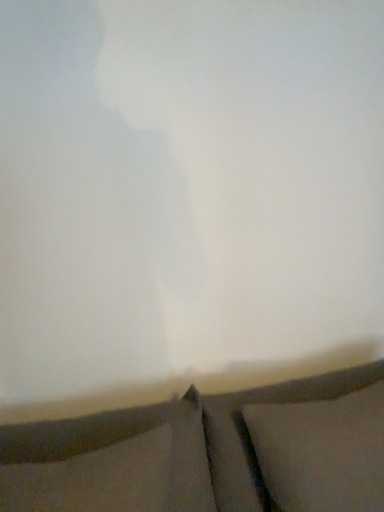
This screenshot has height=512, width=384. Describe the element at coordinates (322, 452) in the screenshot. I see `white soft pillow at lower right, the first pillow in the right-to-left sequence` at that location.

This screenshot has height=512, width=384. In order to click on dark gray fabric pillow at lower center, the first pillow in the left-to-right sequence in this screenshot , I will do `click(109, 462)`.

What's the angular difference between dark gray fabric pillow at lower center, the first pillow in the left-to-right sequence, and white soft pillow at lower right, which is the 2th pillow from left to right,'s facing directions?

There is a 0.000762-degree angle between the facing directions of dark gray fabric pillow at lower center, the first pillow in the left-to-right sequence, and white soft pillow at lower right, which is the 2th pillow from left to right.

Is there a large distance between dark gray fabric pillow at lower center, positioned as the 2th pillow in right-to-left order, and white soft pillow at lower right, the first pillow in the right-to-left sequence?

dark gray fabric pillow at lower center, positioned as the 2th pillow in right-to-left order, is near white soft pillow at lower right, the first pillow in the right-to-left sequence, not far away.

From the image's perspective, is dark gray fabric pillow at lower center, positioned as the 2th pillow in right-to-left order, located above or below white soft pillow at lower right, the first pillow in the right-to-left sequence?

dark gray fabric pillow at lower center, positioned as the 2th pillow in right-to-left order, is situated higher than white soft pillow at lower right, the first pillow in the right-to-left sequence, in the image.

Does dark gray fabric pillow at lower center, positioned as the 2th pillow in right-to-left order, come in front of white soft pillow at lower right, which is the 2th pillow from left to right?

Yes, dark gray fabric pillow at lower center, positioned as the 2th pillow in right-to-left order, is closer to the viewer.

From a real-world perspective, is white soft pillow at lower right, the first pillow in the right-to-left sequence, positioned above or below textured gray curtain at bottom?

Clearly, from a real-world perspective, white soft pillow at lower right, the first pillow in the right-to-left sequence, is above textured gray curtain at bottom.

From the image's perspective, which is below, white soft pillow at lower right, which is the 2th pillow from left to right, or textured gray curtain at bottom?

textured gray curtain at bottom.

Considering the relative positions of white soft pillow at lower right, which is the 2th pillow from left to right, and textured gray curtain at bottom in the image provided, is white soft pillow at lower right, which is the 2th pillow from left to right, in front of textured gray curtain at bottom?

No, it is behind textured gray curtain at bottom.

Which of these two, white soft pillow at lower right, the first pillow in the right-to-left sequence, or textured gray curtain at bottom, is thinner?

With smaller width is white soft pillow at lower right, the first pillow in the right-to-left sequence.

From the image's perspective, is dark gray fabric pillow at lower center, the first pillow in the left-to-right sequence, beneath textured gray curtain at bottom?

Incorrect, from the image's perspective, dark gray fabric pillow at lower center, the first pillow in the left-to-right sequence, is higher than textured gray curtain at bottom.

What's the angular difference between dark gray fabric pillow at lower center, the first pillow in the left-to-right sequence, and textured gray curtain at bottom's facing directions?

They differ by 0.401 degrees in their facing directions.

Does dark gray fabric pillow at lower center, the first pillow in the left-to-right sequence, appear on the left side of textured gray curtain at bottom?

Correct, you'll find dark gray fabric pillow at lower center, the first pillow in the left-to-right sequence, to the left of textured gray curtain at bottom.

How distant is dark gray fabric pillow at lower center, the first pillow in the left-to-right sequence, from textured gray curtain at bottom?

2.96 inches.

Which is in front, textured gray curtain at bottom or white soft pillow at lower right, the first pillow in the right-to-left sequence?

textured gray curtain at bottom is more forward.

Considering the positions of points (73, 478) and (312, 483), is point (73, 478) farther from camera compared to point (312, 483)?

No.

Can you confirm if textured gray curtain at bottom is taller than white soft pillow at lower right, which is the 2th pillow from left to right?

Yes.

In the scene shown: Can you confirm if textured gray curtain at bottom is thinner than white soft pillow at lower right, which is the 2th pillow from left to right?

No.

From the image's perspective, is white soft pillow at lower right, which is the 2th pillow from left to right, under dark gray fabric pillow at lower center, the first pillow in the left-to-right sequence?

Yes, from the image's perspective, white soft pillow at lower right, which is the 2th pillow from left to right, is beneath dark gray fabric pillow at lower center, the first pillow in the left-to-right sequence.

Which is more to the right, white soft pillow at lower right, the first pillow in the right-to-left sequence, or dark gray fabric pillow at lower center, the first pillow in the left-to-right sequence?

white soft pillow at lower right, the first pillow in the right-to-left sequence, is more to the right.

Is point (275, 486) positioned behind point (86, 492)?

Yes.

Considering the sizes of white soft pillow at lower right, the first pillow in the right-to-left sequence, and dark gray fabric pillow at lower center, positioned as the 2th pillow in right-to-left order, in the image, is white soft pillow at lower right, the first pillow in the right-to-left sequence, bigger or smaller than dark gray fabric pillow at lower center, positioned as the 2th pillow in right-to-left order,?

white soft pillow at lower right, the first pillow in the right-to-left sequence, is bigger than dark gray fabric pillow at lower center, positioned as the 2th pillow in right-to-left order.

In the scene shown: How many degrees apart are the facing directions of textured gray curtain at bottom and dark gray fabric pillow at lower center, the first pillow in the left-to-right sequence?

The angle between the facing direction of textured gray curtain at bottom and the facing direction of dark gray fabric pillow at lower center, the first pillow in the left-to-right sequence, is 0.401 degrees.

Is textured gray curtain at bottom in front of or behind dark gray fabric pillow at lower center, positioned as the 2th pillow in right-to-left order, in the image?

Visually, textured gray curtain at bottom is located in front of dark gray fabric pillow at lower center, positioned as the 2th pillow in right-to-left order.

In order to click on pillow that is the 1st object located behind the textured gray curtain at bottom in this screenshot , I will do `click(109, 462)`.

Is dark gray fabric pillow at lower center, the first pillow in the left-to-right sequence, at the back of textured gray curtain at bottom?

No, textured gray curtain at bottom's orientation is not away from dark gray fabric pillow at lower center, the first pillow in the left-to-right sequence.

This screenshot has width=384, height=512. I want to click on pillow that appears below the dark gray fabric pillow at lower center, positioned as the 2th pillow in right-to-left order (from a real-world perspective), so click(322, 452).

Where is `furniture below the white soft pillow at lower right, the first pillow in the right-to-left sequence (from the image's perspective)`? The width and height of the screenshot is (384, 512). furniture below the white soft pillow at lower right, the first pillow in the right-to-left sequence (from the image's perspective) is located at coordinates (210, 452).

From the image, which object appears to be farther from white soft pillow at lower right, the first pillow in the right-to-left sequence, textured gray curtain at bottom or dark gray fabric pillow at lower center, the first pillow in the left-to-right sequence?

dark gray fabric pillow at lower center, the first pillow in the left-to-right sequence, is positioned further to the anchor white soft pillow at lower right, the first pillow in the right-to-left sequence.

From the image, which object appears to be farther from dark gray fabric pillow at lower center, positioned as the 2th pillow in right-to-left order, textured gray curtain at bottom or white soft pillow at lower right, which is the 2th pillow from left to right?

white soft pillow at lower right, which is the 2th pillow from left to right, is positioned further to the anchor dark gray fabric pillow at lower center, positioned as the 2th pillow in right-to-left order.

When comparing their distances from white soft pillow at lower right, which is the 2th pillow from left to right, does dark gray fabric pillow at lower center, the first pillow in the left-to-right sequence, or textured gray curtain at bottom seem closer?

Based on the image, textured gray curtain at bottom appears to be nearer to white soft pillow at lower right, which is the 2th pillow from left to right.

Estimate the real-world distances between objects in this image. Which object is closer to textured gray curtain at bottom, white soft pillow at lower right, the first pillow in the right-to-left sequence, or dark gray fabric pillow at lower center, positioned as the 2th pillow in right-to-left order?

The object closer to textured gray curtain at bottom is dark gray fabric pillow at lower center, positioned as the 2th pillow in right-to-left order.

Looking at the image, which one is located further to dark gray fabric pillow at lower center, the first pillow in the left-to-right sequence, white soft pillow at lower right, which is the 2th pillow from left to right, or textured gray curtain at bottom?

white soft pillow at lower right, which is the 2th pillow from left to right, is further to dark gray fabric pillow at lower center, the first pillow in the left-to-right sequence.

In the scene shown: Considering their positions, is dark gray fabric pillow at lower center, the first pillow in the left-to-right sequence, positioned closer to textured gray curtain at bottom than white soft pillow at lower right, which is the 2th pillow from left to right?

The object closer to textured gray curtain at bottom is dark gray fabric pillow at lower center, the first pillow in the left-to-right sequence.

The width and height of the screenshot is (384, 512). Find the location of `furniture between dark gray fabric pillow at lower center, positioned as the 2th pillow in right-to-left order, and white soft pillow at lower right, the first pillow in the right-to-left sequence, in the horizontal direction`. furniture between dark gray fabric pillow at lower center, positioned as the 2th pillow in right-to-left order, and white soft pillow at lower right, the first pillow in the right-to-left sequence, in the horizontal direction is located at coordinates (210, 452).